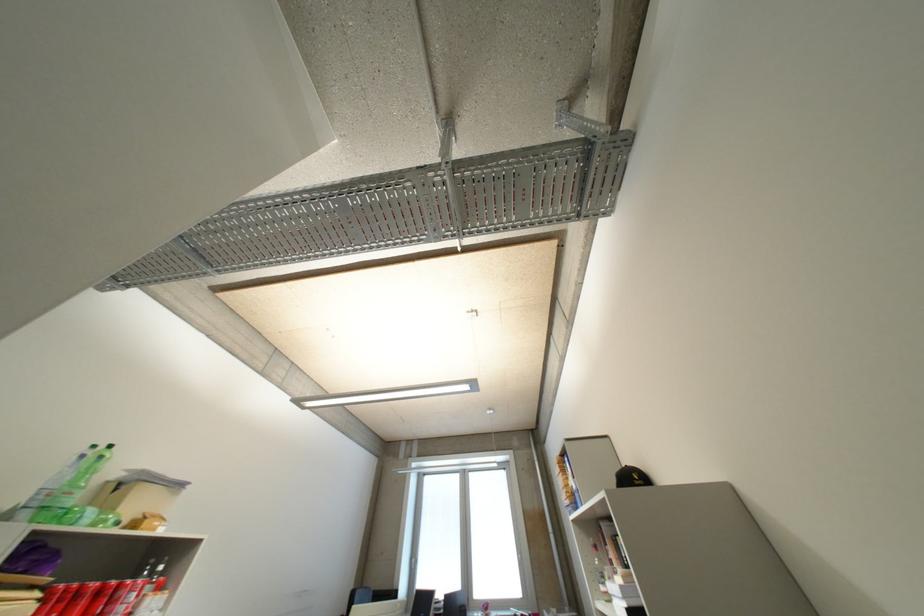
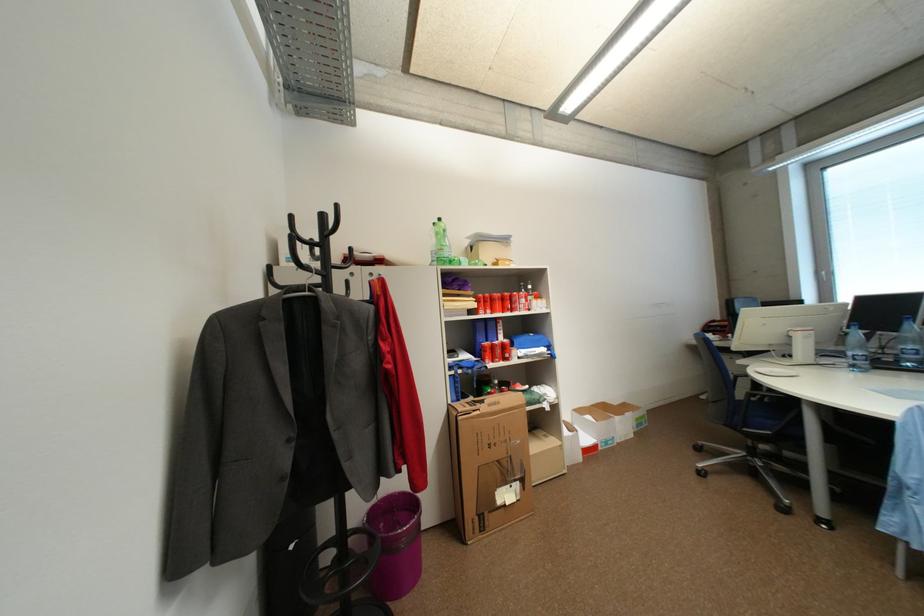
In the second image, find the point that corresponds to (x=103, y=448) in the first image.

(443, 225)